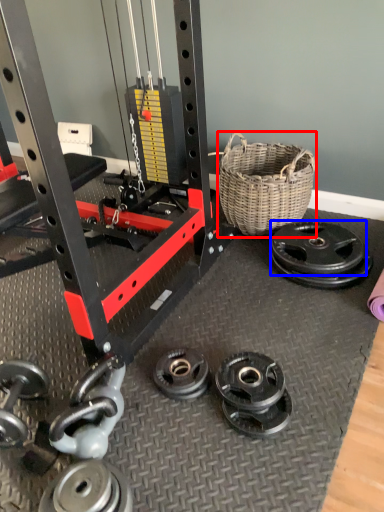
Question: Which object is closer to the camera taking this photo, picnic basket (highlighted by a red box) or wheel (highlighted by a blue box)?

Choices:
 (A) picnic basket
 (B) wheel

Answer: (B)